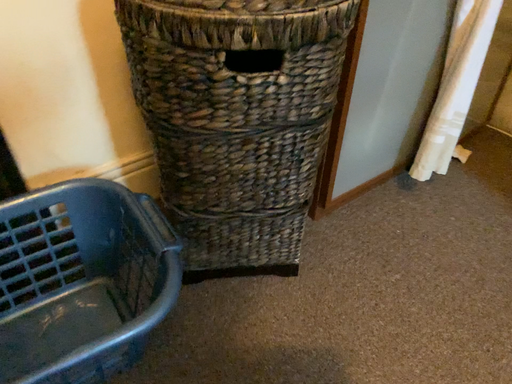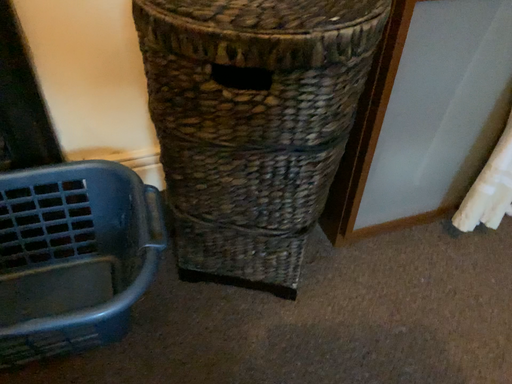
Question: How did the camera likely rotate when shooting the video?

Choices:
 (A) rotated left
 (B) rotated right

Answer: (A)